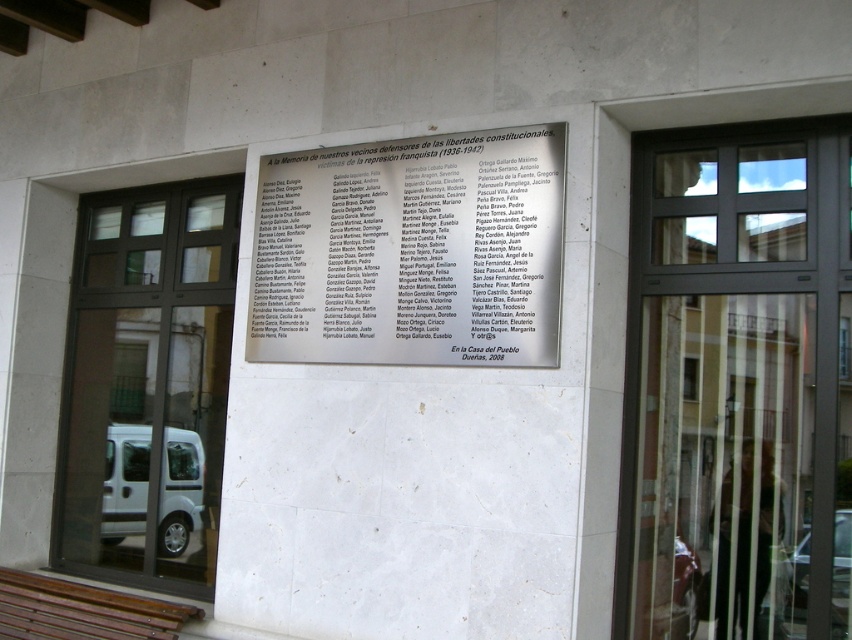
You are a visitor approaching the building and see the commemorative plaque on the wall. There are two doors in front of you labeled metallic glass door at center and black glass door at center. According to the plaque, which door is positioned to the right of the other?

The metallic glass door at center is positioned to the right of the black glass door at center.

You are standing in front of the building exterior with the commemorative plaque. There is a metallic glass door at center. Based on the coordinates provided, can you determine if the door is positioned to the left or right of the plaque?

The metallic glass door at center is positioned at coordinates (737, 385). Since the plaque is located on the exterior wall and the door is at the center, the door is likely positioned to the right of the plaque based on the coordinate system where higher x values indicate rightward direction.